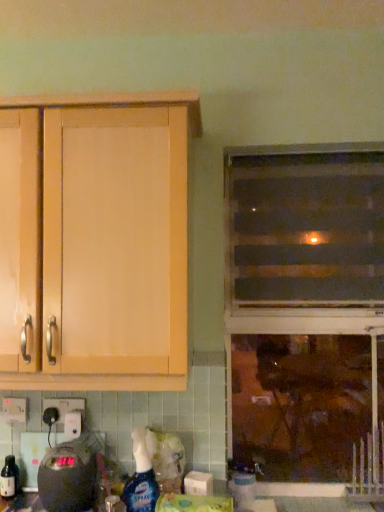
Question: Considering the relative positions of black plastic scale at lower left and translucent plastic spray bottle at lower center in the image provided, is black plastic scale at lower left to the left of translucent plastic spray bottle at lower center from the viewer's perspective?

Choices:
 (A) yes
 (B) no

Answer: (A)

Question: From a real-world perspective, does black plastic scale at lower left stand above translucent plastic spray bottle at lower center?

Choices:
 (A) no
 (B) yes

Answer: (A)

Question: Does black plastic scale at lower left have a lesser width compared to translucent plastic spray bottle at lower center?

Choices:
 (A) no
 (B) yes

Answer: (A)

Question: Would you say black plastic scale at lower left is outside translucent plastic spray bottle at lower center?

Choices:
 (A) no
 (B) yes

Answer: (B)

Question: Considering the relative sizes of black plastic scale at lower left and translucent plastic spray bottle at lower center in the image provided, is black plastic scale at lower left smaller than translucent plastic spray bottle at lower center?

Choices:
 (A) no
 (B) yes

Answer: (A)

Question: Is black plastic scale at lower left further to camera compared to translucent plastic spray bottle at lower center?

Choices:
 (A) yes
 (B) no

Answer: (B)

Question: From a real-world perspective, is transparent glass window at center on white plastic electric outlet at lower left?

Choices:
 (A) no
 (B) yes

Answer: (B)

Question: Is transparent glass window at center facing towards white plastic electric outlet at lower left?

Choices:
 (A) no
 (B) yes

Answer: (A)

Question: Does transparent glass window at center have a greater height compared to white plastic electric outlet at lower left?

Choices:
 (A) no
 (B) yes

Answer: (B)

Question: Is transparent glass window at center not within white plastic electric outlet at lower left?

Choices:
 (A) yes
 (B) no

Answer: (A)

Question: From a real-world perspective, does transparent glass window at center sit lower than white plastic electric outlet at lower left?

Choices:
 (A) yes
 (B) no

Answer: (B)

Question: Can you confirm if transparent glass window at center is shorter than white plastic electric outlet at lower left?

Choices:
 (A) yes
 (B) no

Answer: (B)

Question: Is translucent plastic spray bottle at lower center oriented away from light wood cabinet at upper left?

Choices:
 (A) no
 (B) yes

Answer: (A)